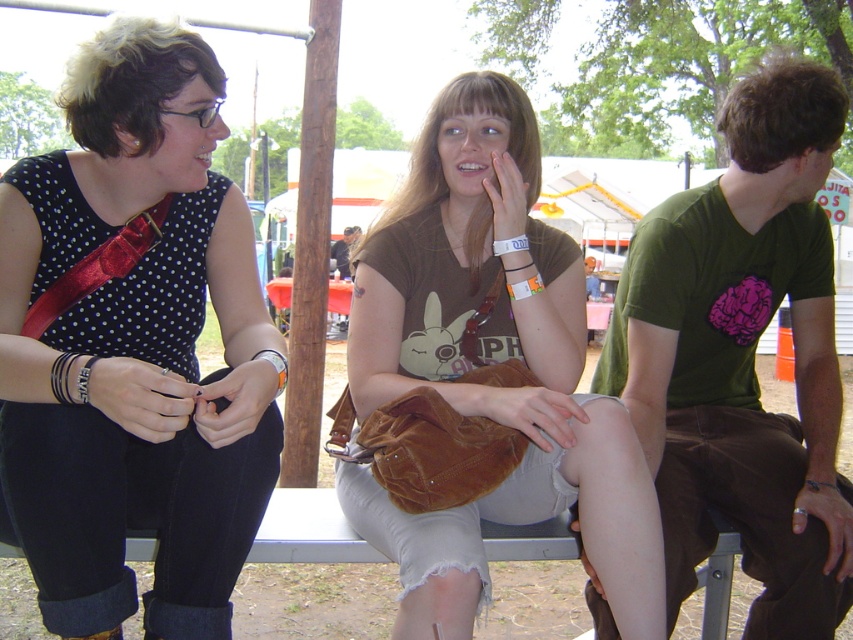
Between point (160, 33) and point (730, 301), which one is positioned behind?

Positioned behind is point (730, 301).

The width and height of the screenshot is (853, 640). Describe the element at coordinates (134, 346) in the screenshot. I see `matte black dress at left` at that location.

The width and height of the screenshot is (853, 640). Describe the element at coordinates (134, 346) in the screenshot. I see `matte black dress at left` at that location.

Locate an element on the screen. This screenshot has height=640, width=853. matte black dress at left is located at coordinates (134, 346).

Is brown suede purse at center below green cotton shirt at right?

Indeed, brown suede purse at center is positioned under green cotton shirt at right.

Does brown suede purse at center have a smaller size compared to green cotton shirt at right?

Yes, brown suede purse at center is smaller than green cotton shirt at right.

Is point (480, 392) in front of point (816, 397)?

Yes, it is in front of point (816, 397).

The image size is (853, 640). Find the location of `brown suede purse at center`. brown suede purse at center is located at coordinates (491, 364).

Is matte black dress at left to the left of brown suede purse at center from the viewer's perspective?

Yes, matte black dress at left is to the left of brown suede purse at center.

Who is more forward, (93, 310) or (357, 412)?

Point (93, 310) is more forward.

Where is `matte black dress at left`? The image size is (853, 640). matte black dress at left is located at coordinates (134, 346).